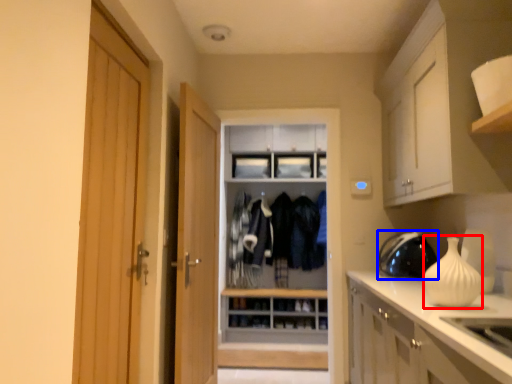
Question: Among these objects, which one is nearest to the camera, vase (highlighted by a red box) or appliance (highlighted by a blue box)?

Choices:
 (A) vase
 (B) appliance

Answer: (A)